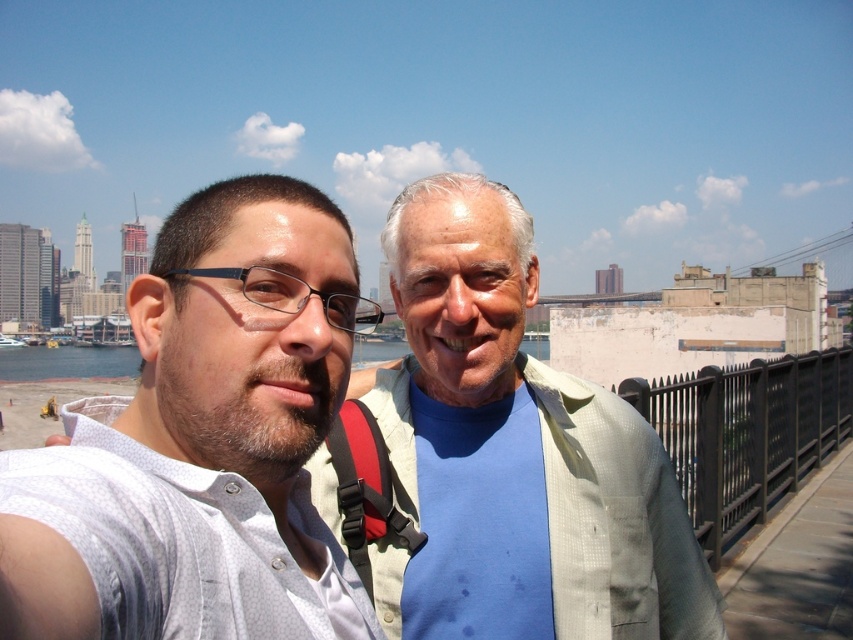
Question: Which is nearer to the clear blue water at center?

Choices:
 (A) white textured shirt at center
 (B) light beige shirt at center

Answer: (B)

Question: Is white textured shirt at center to the right of light beige shirt at center from the viewer's perspective?

Choices:
 (A) no
 (B) yes

Answer: (A)

Question: Is white textured shirt at center further to the viewer compared to light beige shirt at center?

Choices:
 (A) no
 (B) yes

Answer: (A)

Question: From the image, what is the correct spatial relationship of white textured shirt at center in relation to light beige shirt at center?

Choices:
 (A) left
 (B) right

Answer: (A)

Question: Considering the real-world distances, which object is closest to the white textured shirt at center?

Choices:
 (A) light beige shirt at center
 (B) clear blue water at center

Answer: (A)

Question: Which point is farther to the camera?

Choices:
 (A) (289, 272)
 (B) (103, 364)

Answer: (B)